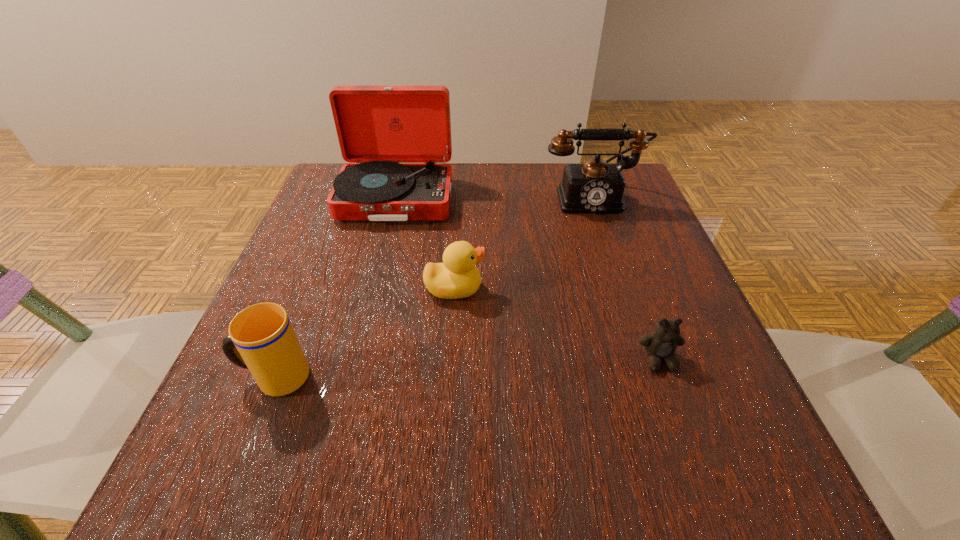
Where is `vacant space at the left edge of the desktop`? vacant space at the left edge of the desktop is located at coordinates (267, 421).

This screenshot has width=960, height=540. In the image, there is a desktop. Find the location of `free space at the right edge`. free space at the right edge is located at coordinates (688, 349).

Locate an element on the screen. This screenshot has width=960, height=540. free space at the near left corner of the desktop is located at coordinates (249, 458).

This screenshot has height=540, width=960. What are the coordinates of `vacant area that lies between the second tallest object and the tallest object` in the screenshot? It's located at coord(493,199).

At what (x,y) coordinates should I click in order to perform the action: click on free space that is in between the shortest object and the fourth shortest object. Please return your answer as a coordinate pair (x, y). Looking at the image, I should click on (625, 279).

This screenshot has width=960, height=540. I want to click on empty space between the third shortest object and the shortest object, so click(x=467, y=368).

What are the coordinates of `unoccupied position between the fourth tallest object and the cup` in the screenshot? It's located at (365, 333).

I want to click on free spot between the third nearest object and the third tallest object, so click(365, 333).

I want to click on free space that is in between the cup and the phonograph_record, so click(335, 288).

This screenshot has width=960, height=540. Find the location of `free space between the shortest object and the third shortest object`. free space between the shortest object and the third shortest object is located at coordinates (467, 368).